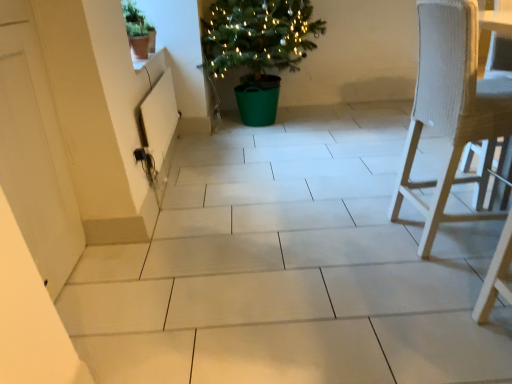
Where is `green matte pot at upper left, which is the second houseplant from back to front`? The width and height of the screenshot is (512, 384). green matte pot at upper left, which is the second houseplant from back to front is located at coordinates (138, 30).

Where is `white matte door at left`? white matte door at left is located at coordinates pyautogui.click(x=35, y=151).

The image size is (512, 384). I want to click on white woven chair at right, so click(x=450, y=108).

From a real-world perspective, is green plastic potted plant at center, acting as the 2th houseplant starting from the front, positioned under white woven chair at right based on gravity?

No, from a real-world perspective, green plastic potted plant at center, acting as the 2th houseplant starting from the front, is not under white woven chair at right.

Are green plastic potted plant at center, which is the first houseplant from right to left, and white woven chair at right located far from each other?

Yes, green plastic potted plant at center, which is the first houseplant from right to left, and white woven chair at right are quite far apart.

This screenshot has width=512, height=384. Find the location of `chair directly beneath the green plastic potted plant at center, which ranks as the 2th houseplant in left-to-right order (from a real-world perspective)`. chair directly beneath the green plastic potted plant at center, which ranks as the 2th houseplant in left-to-right order (from a real-world perspective) is located at coordinates (450, 108).

From a real-world perspective, is white matte door at left positioned over green plastic potted plant at center, acting as the 2th houseplant starting from the front, based on gravity?

Yes, from a real-world perspective, white matte door at left is over green plastic potted plant at center, acting as the 2th houseplant starting from the front

Is white matte door at left taller than green plastic potted plant at center, which ranks as the 2th houseplant in left-to-right order?

Correct, white matte door at left is much taller as green plastic potted plant at center, which ranks as the 2th houseplant in left-to-right order.

From the image's perspective, relative to green plastic potted plant at center, acting as the 2th houseplant starting from the front, is white matte door at left above or below?

From the image's perspective, white matte door at left appears below green plastic potted plant at center, acting as the 2th houseplant starting from the front.

Locate an element on the screen. This screenshot has height=384, width=512. the 2nd houseplant above the white matte door at left (from the image's perspective) is located at coordinates (258, 48).

Is green plastic potted plant at center, which ranks as the 2th houseplant in left-to-right order, shorter than green matte pot at upper left, which is the second houseplant from back to front?

In fact, green plastic potted plant at center, which ranks as the 2th houseplant in left-to-right order, may be taller than green matte pot at upper left, which is the second houseplant from back to front.

Can you tell me how much green plastic potted plant at center, which is the 1th houseplant from back to front, and green matte pot at upper left, which ranks as the 1th houseplant in left-to-right order, differ in facing direction?

The angular difference between green plastic potted plant at center, which is the 1th houseplant from back to front, and green matte pot at upper left, which ranks as the 1th houseplant in left-to-right order, is 93.2 degrees.

Can you confirm if green plastic potted plant at center, which is the 1th houseplant from back to front, is wider than green matte pot at upper left, which is the second houseplant from back to front?

Yes, green plastic potted plant at center, which is the 1th houseplant from back to front, is wider than green matte pot at upper left, which is the second houseplant from back to front.

Where is `houseplant on the right of green matte pot at upper left, which is the second houseplant from back to front`? houseplant on the right of green matte pot at upper left, which is the second houseplant from back to front is located at coordinates (258, 48).

Is white woven chair at right wider than green plastic potted plant at center, which is the 1th houseplant from back to front?

Incorrect, the width of white woven chair at right does not surpass that of green plastic potted plant at center, which is the 1th houseplant from back to front.

From the image's perspective, relative to green plastic potted plant at center, which is the first houseplant from right to left, is white woven chair at right above or below?

white woven chair at right is below green plastic potted plant at center, which is the first houseplant from right to left.

From the picture: Considering the sizes of white woven chair at right and green plastic potted plant at center, which is the first houseplant from right to left, in the image, is white woven chair at right bigger or smaller than green plastic potted plant at center, which is the first houseplant from right to left,?

Clearly, white woven chair at right is smaller in size than green plastic potted plant at center, which is the first houseplant from right to left.

In order to click on chair that is on the right side of green matte pot at upper left, which is the second houseplant from back to front in this screenshot , I will do `click(450, 108)`.

Between point (403, 191) and point (153, 45), which one is positioned in front?

The point (403, 191) is closer to the camera.

Does white woven chair at right have a greater width compared to green matte pot at upper left, which is the first houseplant in front-to-back order?

Indeed, white woven chair at right has a greater width compared to green matte pot at upper left, which is the first houseplant in front-to-back order.

Which of these two, white woven chair at right or white matte door at left, stands shorter?

white woven chair at right.

Does white woven chair at right appear on the left side of white matte door at left?

No.

From the image's perspective, is white woven chair at right above white matte door at left?

Yes.

Does white woven chair at right touch white matte door at left?

No.

Which is further, (x=260, y=62) or (x=42, y=76)?

The point (x=260, y=62) is farther from the camera.

From a real-world perspective, who is located higher, green plastic potted plant at center, which is the first houseplant from right to left, or white matte door at left?

white matte door at left, from a real-world perspective.

Is green plastic potted plant at center, which ranks as the 2th houseplant in left-to-right order, in front of or behind white matte door at left in the image?

green plastic potted plant at center, which ranks as the 2th houseplant in left-to-right order, is positioned farther from the viewer than white matte door at left.

This screenshot has width=512, height=384. What are the coordinates of `the 1st houseplant to the left when counting from the white woven chair at right` in the screenshot? It's located at click(258, 48).

Locate an element on the screen. This screenshot has height=384, width=512. screen door in front of the green plastic potted plant at center, acting as the 2th houseplant starting from the front is located at coordinates (35, 151).

Which object lies nearer to the anchor point green plastic potted plant at center, which is the 1th houseplant from back to front, white woven chair at right or green matte pot at upper left, arranged as the second houseplant when viewed from the right?

green matte pot at upper left, arranged as the second houseplant when viewed from the right, is positioned closer to the anchor green plastic potted plant at center, which is the 1th houseplant from back to front.

Looking at this image, estimate the real-world distances between objects in this image. Which object is further from green matte pot at upper left, which is the second houseplant from back to front, white matte door at left or green plastic potted plant at center, acting as the 2th houseplant starting from the front?

white matte door at left is further to green matte pot at upper left, which is the second houseplant from back to front.

From the image, which object appears to be nearer to green plastic potted plant at center, which ranks as the 2th houseplant in left-to-right order, green matte pot at upper left, which is the second houseplant from back to front, or white matte door at left?

Based on the image, green matte pot at upper left, which is the second houseplant from back to front, appears to be nearer to green plastic potted plant at center, which ranks as the 2th houseplant in left-to-right order.

From the image, which object appears to be nearer to white woven chair at right, white matte door at left or green matte pot at upper left, arranged as the second houseplant when viewed from the right?

Among the two, white matte door at left is located nearer to white woven chair at right.

Estimate the real-world distances between objects in this image. Which object is further from green plastic potted plant at center, which ranks as the 2th houseplant in left-to-right order, white matte door at left or green matte pot at upper left, which ranks as the 1th houseplant in left-to-right order?

Based on the image, white matte door at left appears to be further to green plastic potted plant at center, which ranks as the 2th houseplant in left-to-right order.

Considering their positions, is green matte pot at upper left, which is the first houseplant in front-to-back order, positioned further to white woven chair at right than green plastic potted plant at center, which is the 1th houseplant from back to front?

Among the two, green plastic potted plant at center, which is the 1th houseplant from back to front, is located further to white woven chair at right.

Looking at this image, estimate the real-world distances between objects in this image. Which object is further from white woven chair at right, green matte pot at upper left, arranged as the second houseplant when viewed from the right, or white matte door at left?

green matte pot at upper left, arranged as the second houseplant when viewed from the right, is positioned further to the anchor white woven chair at right.

Which object lies further to the anchor point green plastic potted plant at center, which ranks as the 2th houseplant in left-to-right order, white matte door at left or white woven chair at right?

Among the two, white matte door at left is located further to green plastic potted plant at center, which ranks as the 2th houseplant in left-to-right order.

Locate an element on the screen. The width and height of the screenshot is (512, 384). houseplant situated between green matte pot at upper left, which ranks as the 1th houseplant in left-to-right order, and white woven chair at right from left to right is located at coordinates coord(258,48).

The width and height of the screenshot is (512, 384). I want to click on houseplant between white matte door at left and green plastic potted plant at center, acting as the 2th houseplant starting from the front, along the z-axis, so click(138, 30).

Image resolution: width=512 pixels, height=384 pixels. Find the location of `chair between white matte door at left and green plastic potted plant at center, which is the first houseplant from right to left, in the front-back direction`. chair between white matte door at left and green plastic potted plant at center, which is the first houseplant from right to left, in the front-back direction is located at coordinates (450, 108).